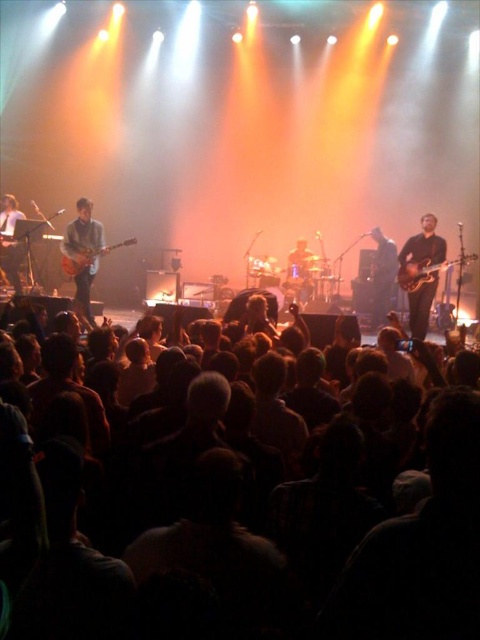
Question: Is shiny brown guitar at right to the left of shiny black guitar at center from the viewer's perspective?

Choices:
 (A) no
 (B) yes

Answer: (B)

Question: Is matte brown guitar at left wider than glossy wood guitar at right?

Choices:
 (A) yes
 (B) no

Answer: (B)

Question: Which point is closer to the camera?

Choices:
 (A) (3, 205)
 (B) (84, 262)
 (C) (420, 337)

Answer: (C)

Question: Which object appears closest to the camera in this image?

Choices:
 (A) matte brown guitar at left
 (B) dark matte crowd at lower center
 (C) wooden electric guitar at left
 (D) glossy wood guitar at right

Answer: (B)

Question: Among these points, which one is farthest from the camera?

Choices:
 (A) (460, 266)
 (B) (197, 532)
 (C) (132, 237)

Answer: (C)

Question: Can you confirm if dark matte crowd at lower center is thinner than shiny brown guitar at right?

Choices:
 (A) yes
 (B) no

Answer: (B)